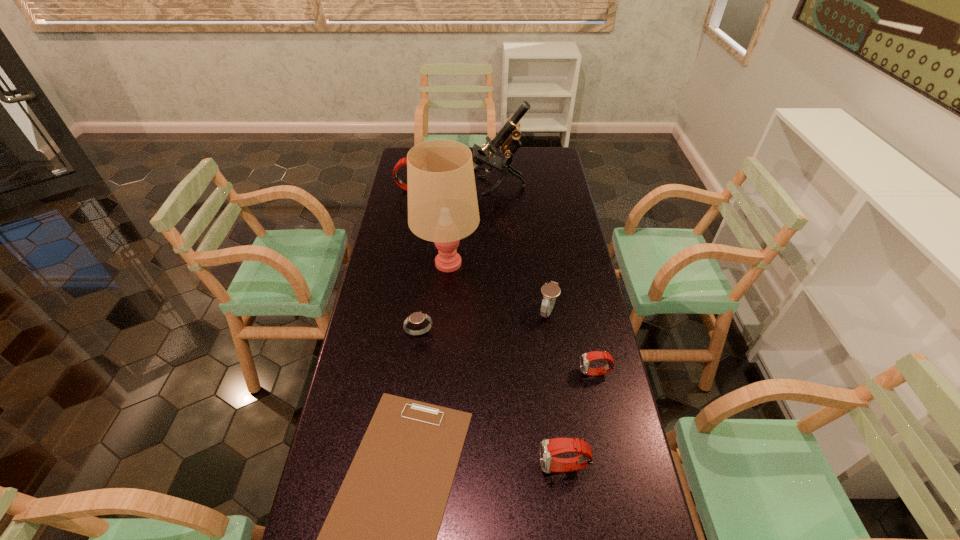
Identify which red watch is the third nearest to the fourth nearest watch. Please provide its 2D coordinates. Your answer should be formatted as a tuple, i.e. [(x, y)], where the tuple contains the x and y coordinates of a point satisfying the conditions above.

[(403, 161)]

Identify the location of vacant area in the image that satisfies the following two spatial constraints: 1. on the back side of the smaller gray watch; 2. on the right side of the third farthest object. This screenshot has width=960, height=540. (428, 262).

Locate an element on the screen. free point that satisfies the following two spatial constraints: 1. on the face of the nearer gray watch; 2. on the left side of the biggest red watch is located at coordinates (385, 333).

The height and width of the screenshot is (540, 960). I want to click on vacant region that satisfies the following two spatial constraints: 1. through the eyepiece of the right gray watch; 2. on the left side of the microscope, so click(499, 312).

At what (x,y) coordinates should I click in order to perform the action: click on vacant space that satisfies the following two spatial constraints: 1. on the face of the pink lampshade; 2. on the left side of the farthest watch. Please return your answer as a coordinate pair (x, y). Looking at the image, I should click on (398, 262).

Locate an element on the screen. This screenshot has width=960, height=540. vacant area in the image that satisfies the following two spatial constraints: 1. on the face of the third tallest object; 2. on the back side of the smaller gray watch is located at coordinates (385, 333).